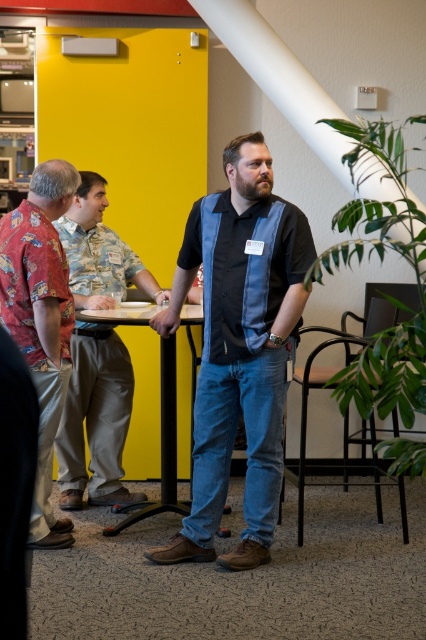
Is printed fabric shirt at left above black plastic table at center?

Yes.

Does printed fabric shirt at left have a larger size compared to black plastic table at center?

Incorrect, printed fabric shirt at left is not larger than black plastic table at center.

Where is `printed fabric shirt at left`? Image resolution: width=426 pixels, height=640 pixels. printed fabric shirt at left is located at coordinates [40, 321].

Is the position of matte khaki pants at left less distant than that of printed fabric shirt at left?

No, matte khaki pants at left is behind printed fabric shirt at left.

Can you confirm if matte khaki pants at left is thinner than printed fabric shirt at left?

Incorrect, matte khaki pants at left's width is not less than printed fabric shirt at left's.

Who is more distant from viewer, (x=80, y=268) or (x=14, y=316)?

The point (x=80, y=268) is more distant.

This screenshot has width=426, height=640. Find the location of `matte khaki pants at left`. matte khaki pants at left is located at coordinates (95, 419).

Which is more to the right, denim jeans at center or black plastic table at center?

denim jeans at center is more to the right.

Is denim jeans at center thinner than black plastic table at center?

No.

Which is behind, point (282, 273) or point (115, 323)?

The point (115, 323) is more distant.

I want to click on denim jeans at center, so click(x=239, y=348).